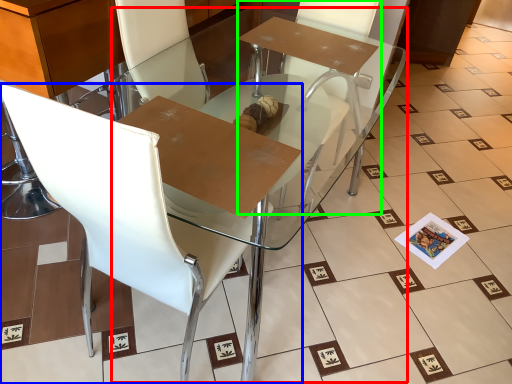
Question: Which is nearer to the round table (highlighted by a red box)? chair (highlighted by a blue box) or armchair (highlighted by a green box).

Choices:
 (A) chair
 (B) armchair

Answer: (B)